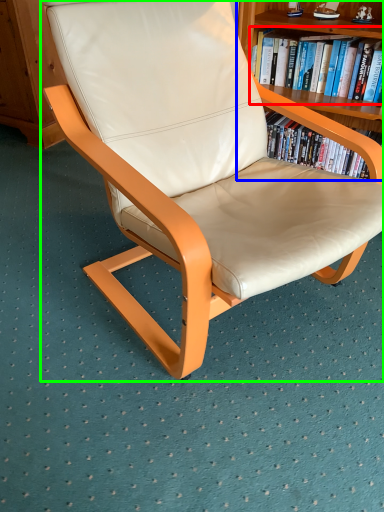
Question: Which object is positioned farthest from book (highlighted by a red box)? Select from bookcase (highlighted by a blue box) and chair (highlighted by a green box).

Choices:
 (A) bookcase
 (B) chair

Answer: (B)